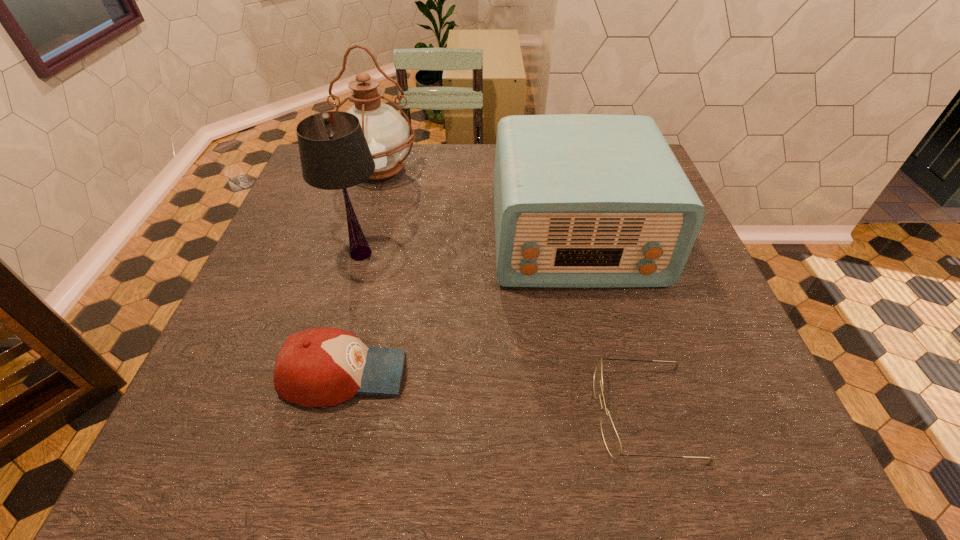
Locate an element on the screen. The height and width of the screenshot is (540, 960). vacant space located 0.400m on the front-facing side of the spectacles is located at coordinates (365, 413).

This screenshot has width=960, height=540. I want to click on vacant space located 0.280m on the front-facing side of the spectacles, so click(x=435, y=413).

Where is `object that is at the far edge`? The height and width of the screenshot is (540, 960). object that is at the far edge is located at coordinates (387, 133).

At what (x,y) coordinates should I click in order to perform the action: click on object located at the near edge. Please return your answer as a coordinate pair (x, y). The image size is (960, 540). Looking at the image, I should click on (611, 439).

Locate an element on the screen. The width and height of the screenshot is (960, 540). oil lamp that is at the left edge is located at coordinates (387, 133).

Image resolution: width=960 pixels, height=540 pixels. In order to click on lampshade that is at the left edge in this screenshot , I will do tap(334, 154).

Identify the location of baseball cap situated at the left edge. (318, 367).

I want to click on radio receiver that is positioned at the right edge, so click(580, 200).

Where is `spectacles situated at the right edge`? spectacles situated at the right edge is located at coordinates (611, 439).

Locate an element on the screen. object that is at the far left corner is located at coordinates (387, 133).